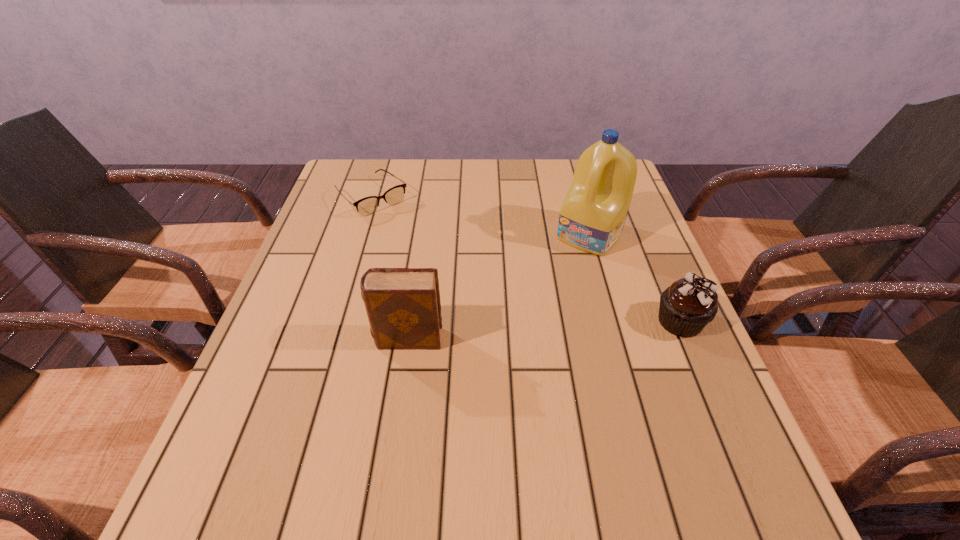
Where is `free space between the third tallest object and the tallest object`? Image resolution: width=960 pixels, height=540 pixels. free space between the third tallest object and the tallest object is located at coordinates (635, 278).

Image resolution: width=960 pixels, height=540 pixels. I want to click on vacant area that lies between the spectacles and the tallest object, so click(x=480, y=216).

At what (x,y) coordinates should I click in order to perform the action: click on vacant point located between the shortest object and the second shortest object. Please return your answer as a coordinate pair (x, y). Looking at the image, I should click on (526, 259).

The height and width of the screenshot is (540, 960). Identify the location of blank region between the spectacles and the tallest object. (480, 216).

You are a GUI agent. You are given a task and a screenshot of the screen. Output one action in this format:
    pyautogui.click(x=<x>, y=<y>)
    Task: Click on the unoccupied area between the detergent and the third shortest object
    This screenshot has width=960, height=540.
    Given the screenshot: What is the action you would take?
    pyautogui.click(x=498, y=287)

This screenshot has height=540, width=960. In order to click on object identified as the third closest to the shortest object in this screenshot , I will do `click(689, 304)`.

The image size is (960, 540). I want to click on object that ranks as the third closest to the second tallest object, so click(689, 304).

Where is `vacant space that satisfies the following two spatial constraints: 1. on the front side of the shortest object; 2. on the left side of the cupcake`? The width and height of the screenshot is (960, 540). vacant space that satisfies the following two spatial constraints: 1. on the front side of the shortest object; 2. on the left side of the cupcake is located at coordinates (332, 321).

I want to click on vacant region that satisfies the following two spatial constraints: 1. on the front side of the shortest object; 2. on the spine side of the diary, so click(326, 339).

Where is `free region that satisfies the following two spatial constraints: 1. on the front side of the spectacles; 2. on the right side of the second shortest object`? The height and width of the screenshot is (540, 960). free region that satisfies the following two spatial constraints: 1. on the front side of the spectacles; 2. on the right side of the second shortest object is located at coordinates (332, 321).